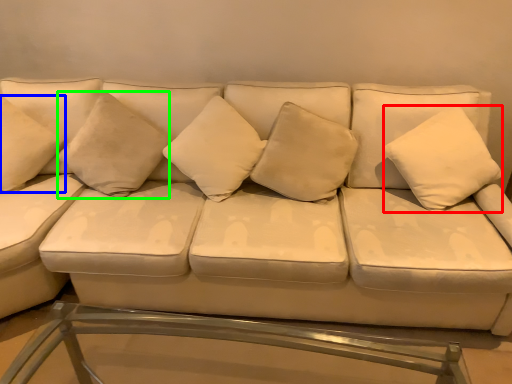
Question: Which object is positioned farthest from pillow (highlighted by a red box)? Select from pillow (highlighted by a blue box) and pillow (highlighted by a green box).

Choices:
 (A) pillow
 (B) pillow

Answer: (A)